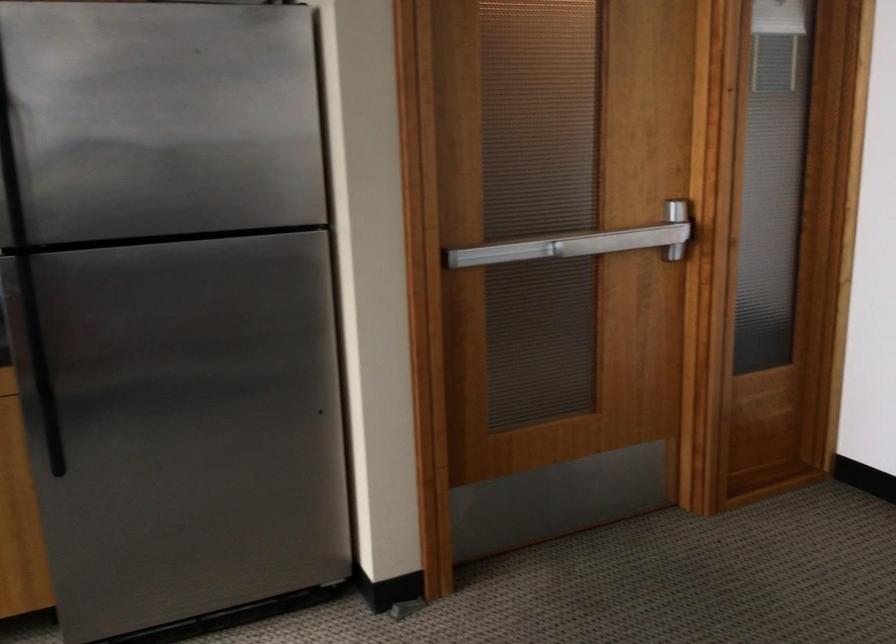
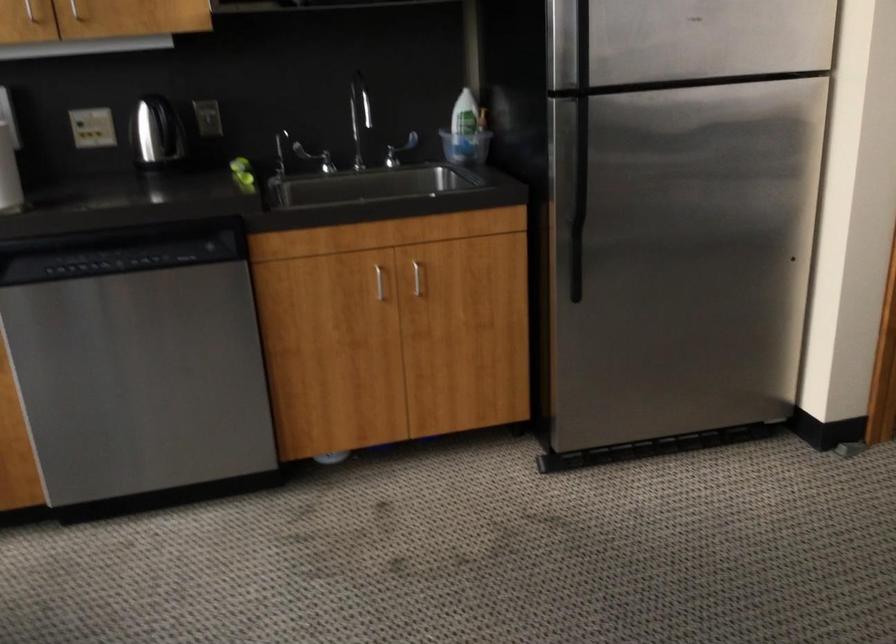
Question: Which direction would the cameraman need to move to produce the second image? Reply with the corresponding letter.

Choices:
 (A) Left
 (B) Right
 (C) Forward
 (D) Backward

Answer: (A)